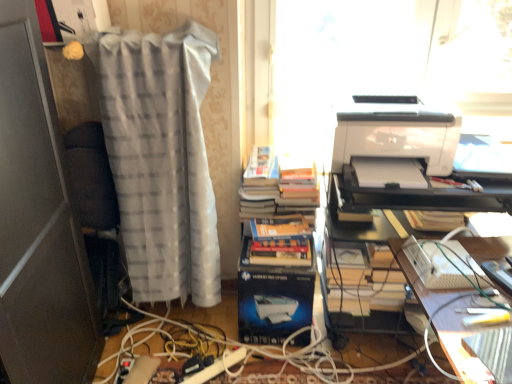
In order to click on free space in front of blue glossy paperback book at center in this screenshot , I will do `click(270, 355)`.